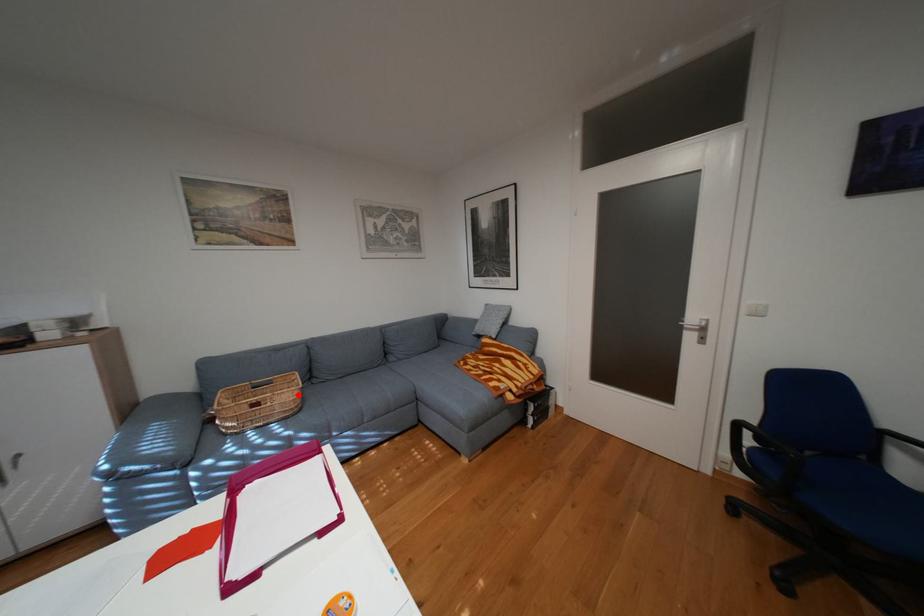
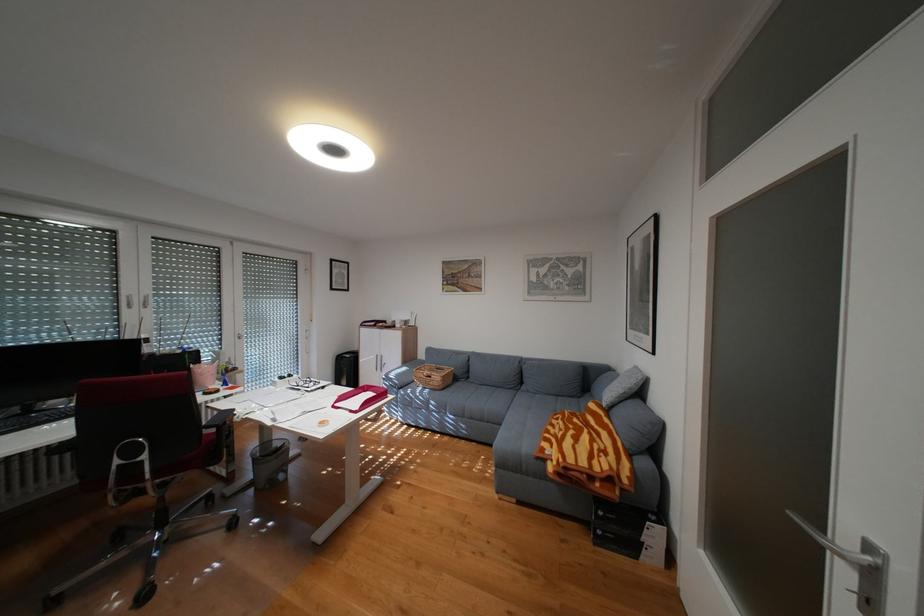
Where in the second image is the point corresponding to the highlighted location from the first image?

(450, 377)